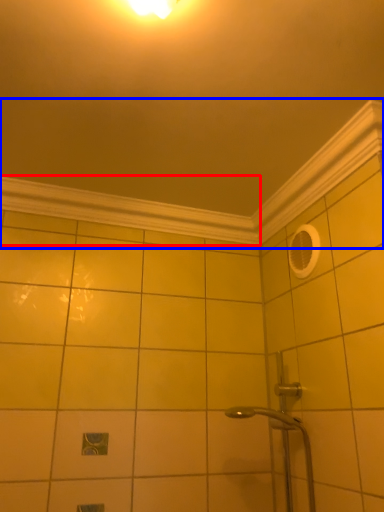
Question: Which object is further to the camera taking this photo, molding (highlighted by a red box) or molding (highlighted by a blue box)?

Choices:
 (A) molding
 (B) molding

Answer: (A)